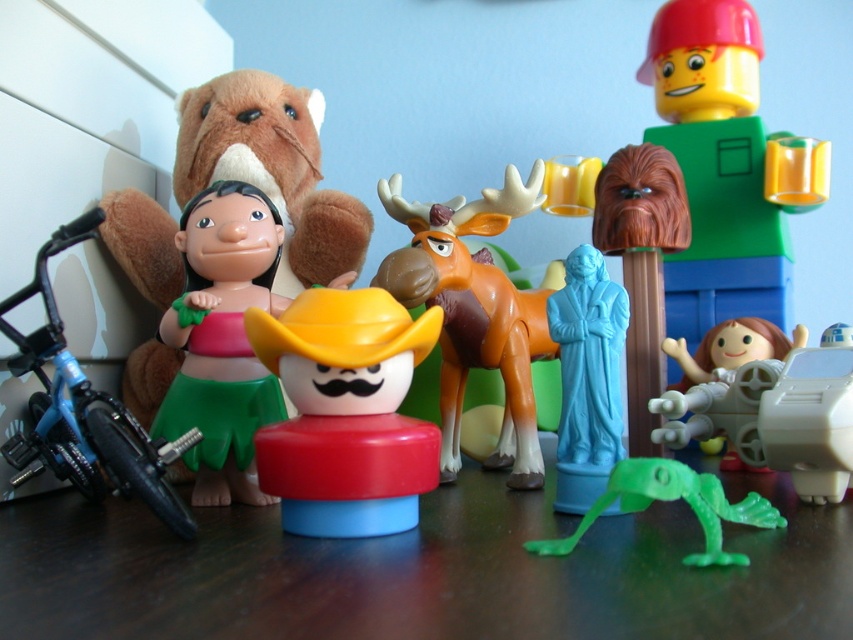
Question: Is brown fuzzy tree at upper right thinner than green matte lizard at lower center?

Choices:
 (A) no
 (B) yes

Answer: (B)

Question: Among these points, which one is nearest to the camera?

Choices:
 (A) (828, 333)
 (B) (656, 36)
 (C) (355, 532)

Answer: (C)

Question: Does green plastic figure at right have a smaller size compared to green matte hula dancer at center?

Choices:
 (A) no
 (B) yes

Answer: (A)

Question: Which point is farther to the camera?

Choices:
 (A) green plastic figure at right
 (B) brown fuzzy tree at upper right

Answer: (A)

Question: Which of the following is the closest to the observer?

Choices:
 (A) blue metallic bicycle at left
 (B) green plastic figure at right
 (C) green matte lizard at lower center
 (D) white plastic toy at lower right

Answer: (C)

Question: Is green plastic figure at right thinner than green matte lizard at lower center?

Choices:
 (A) yes
 (B) no

Answer: (B)